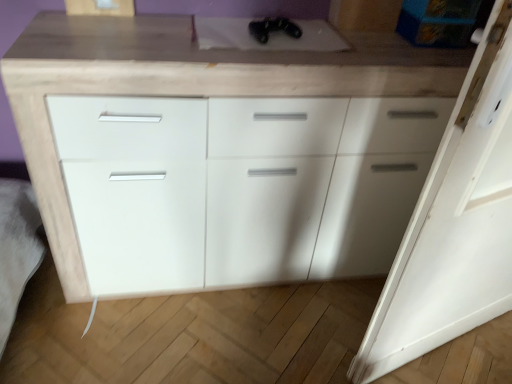
You are a GUI agent. You are given a task and a screenshot of the screen. Output one action in this format:
    pyautogui.click(x=<x>, y=<y>)
    Task: Click on the free space in front of white matte cabinet at center
    Image resolution: width=512 pixels, height=384 pixels.
    Given the screenshot: What is the action you would take?
    pyautogui.click(x=229, y=335)